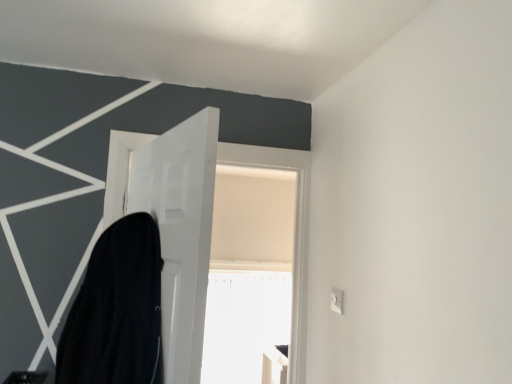
This screenshot has width=512, height=384. In order to click on white matte door at center in this screenshot , I will do `click(180, 231)`.

What do you see at coordinates (180, 231) in the screenshot? This screenshot has height=384, width=512. I see `white matte door at center` at bounding box center [180, 231].

The image size is (512, 384). I want to click on black matte robe at left, so click(117, 310).

What do you see at coordinates (117, 310) in the screenshot?
I see `black matte robe at left` at bounding box center [117, 310].

In order to face black matte robe at left, should I rotate leftwards or rightwards?

To align with it, rotate left about 20.361°.

Locate an element on the screen. white matte door at center is located at coordinates [180, 231].

Consider the image. Which is more to the left, white matte door at center or black matte robe at left?

black matte robe at left.

Between white matte door at center and black matte robe at left, which one is positioned behind?

white matte door at center.

Is point (167, 177) positioned behind point (127, 289)?

Yes, it is behind point (127, 289).

From the picture: From the image's perspective, which one is positioned higher, white matte door at center or black matte robe at left?

white matte door at center appears higher in the image.

From a real-world perspective, who is located lower, white matte door at center or black matte robe at left?

black matte robe at left.

Which of these two, white matte door at center or black matte robe at left, is wider?

black matte robe at left is wider.

In terms of height, does white matte door at center look taller or shorter compared to black matte robe at left?

Clearly, white matte door at center is taller compared to black matte robe at left.

Considering the relative sizes of white matte door at center and black matte robe at left in the image provided, is white matte door at center bigger than black matte robe at left?

Indeed, white matte door at center has a larger size compared to black matte robe at left.

Is white matte door at center not inside black matte robe at left?

Yes, white matte door at center is not within black matte robe at left.

Does white matte door at center touch black matte robe at left?

They are not placed beside each other.

Is white matte door at center facing towards black matte robe at left?

Yes.

The height and width of the screenshot is (384, 512). I want to click on door that is on the right side of black matte robe at left, so click(180, 231).

Which object is positioned more to the left, black matte robe at left or white matte door at center?

From the viewer's perspective, black matte robe at left appears more on the left side.

Is black matte robe at left positioned behind white matte door at center?

That is False.

Between point (113, 281) and point (196, 126), which one is positioned in front?

Positioned in front is point (196, 126).

From the image's perspective, is black matte robe at left positioned above or below white matte door at center?

From the image's perspective, black matte robe at left appears below white matte door at center.

From a real-world perspective, is black matte robe at left positioned under white matte door at center based on gravity?

Indeed, from a real-world perspective, black matte robe at left is positioned beneath white matte door at center.

In the scene shown: Which of these two, black matte robe at left or white matte door at center, is wider?

With larger width is black matte robe at left.

Can you confirm if black matte robe at left is shorter than white matte door at center?

Correct, black matte robe at left is not as tall as white matte door at center.

Which of these two, black matte robe at left or white matte door at center, is bigger?

white matte door at center is bigger.

Which is correct: black matte robe at left is inside white matte door at center, or outside of it?

The correct answer is: outside.

Is there a large distance between black matte robe at left and white matte door at center?

No, black matte robe at left is in close proximity to white matte door at center.

Is white matte door at center at the back of black matte robe at left?

Yes, black matte robe at left is positioned with its back facing white matte door at center.

Can you tell me how much black matte robe at left and white matte door at center differ in facing direction?

The angular difference between black matte robe at left and white matte door at center is 0.151 degrees.

Where is `robe in front of the white matte door at center`? The height and width of the screenshot is (384, 512). robe in front of the white matte door at center is located at coordinates (117, 310).

Locate an element on the screen. Image resolution: width=512 pixels, height=384 pixels. door lying behind the black matte robe at left is located at coordinates (180, 231).

This screenshot has height=384, width=512. I want to click on robe on the left of white matte door at center, so click(117, 310).